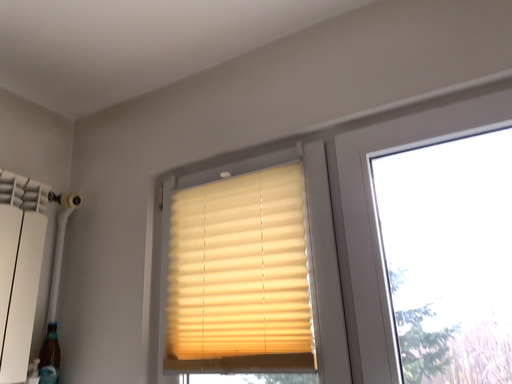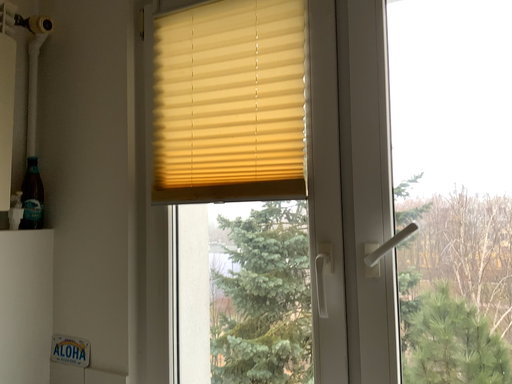
Question: Which way did the camera rotate in the video?

Choices:
 (A) rotated upward
 (B) rotated downward

Answer: (B)